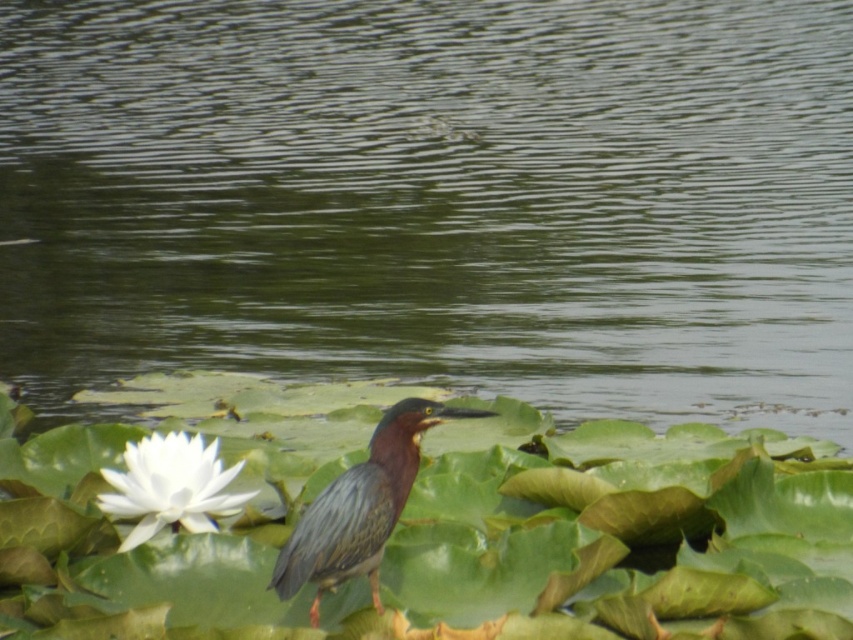
You are a photographer trying to capture the white matte flower at lower left. You notice the greenish water at center is blocking your view. Can you move the flower to the right to avoid the water?

The greenish water at center is positioned over white matte flower at lower left, so moving the flower to the right might help avoid the obstruction caused by the water.

You are a photographer trying to capture the green glossy heron at center. You notice the greenish water at center is in the way. Can you adjust your position to focus on the heron without the water obstructing the view?

The greenish water at center is further to the viewer than the green glossy heron at center, so moving your camera position closer to the heron or adjusting the angle might allow you to focus on the heron while the water appears behind it, reducing obstruction.